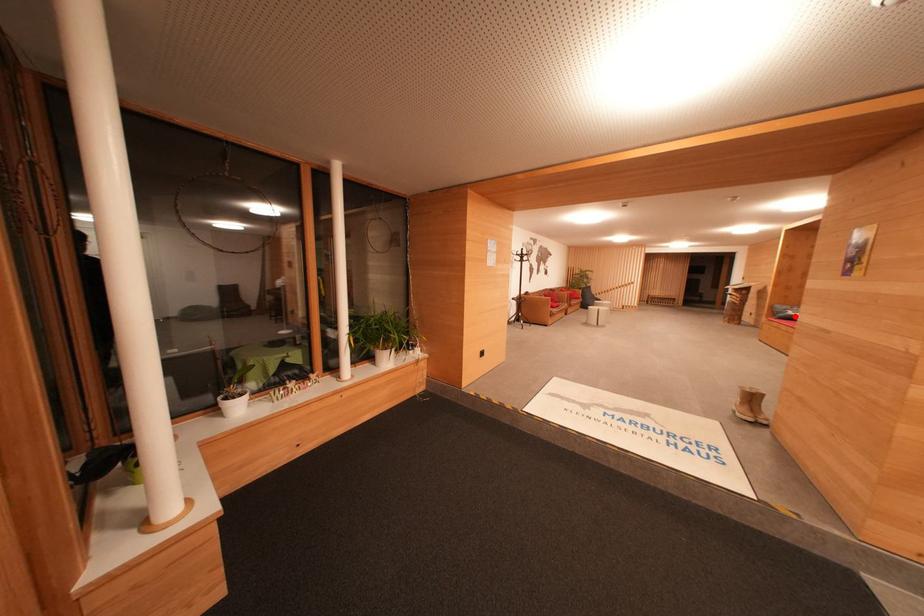
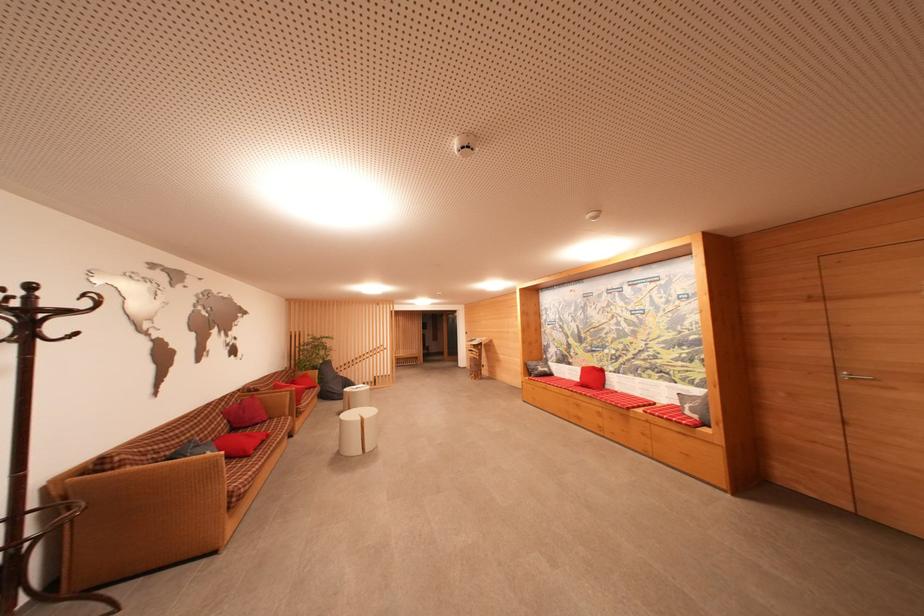
Question: I am providing you with two images of the same scene from different viewpoints. Image1 has a red point marked. In image2, the corresponding 3D location appears at what relative position? Reply with the corresponding letter.

Choices:
 (A) Closer
 (B) Farther

Answer: (A)